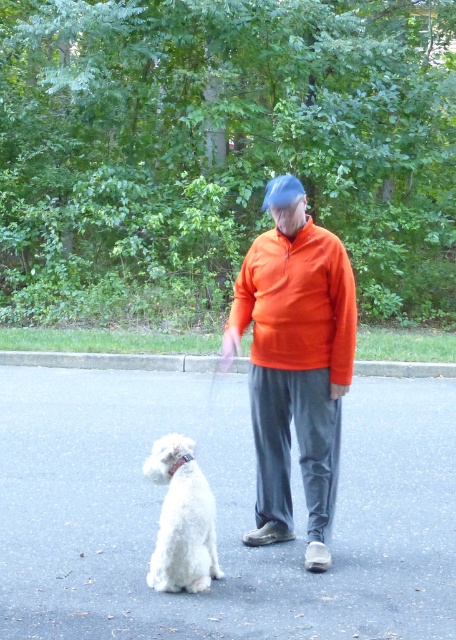
You are a photographer setting up a shot of the orange fleece jacket at center and the white fluffy dog at lower left. You want to ensure both subjects are fully in frame. Which subject requires more horizontal space in the camera frame?

The orange fleece jacket at center requires more horizontal space because it is wider than the white fluffy dog at lower left.

You are standing in the driveway and see the orange fleece sweatshirt at center and the white fluffy dog at lower left. Which object is higher up in the scene?

The orange fleece sweatshirt at center is located above the white fluffy dog at lower left, so it is higher up in the scene.